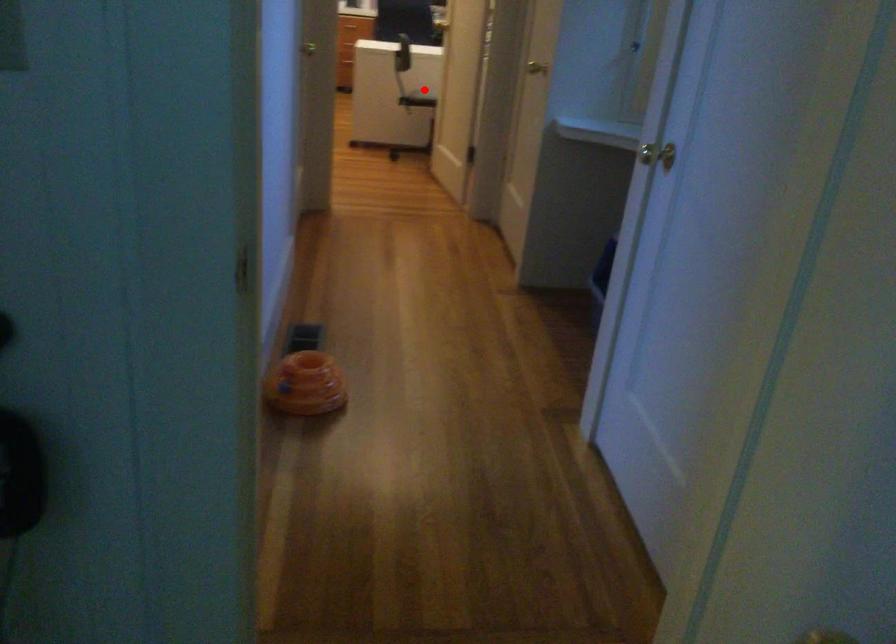
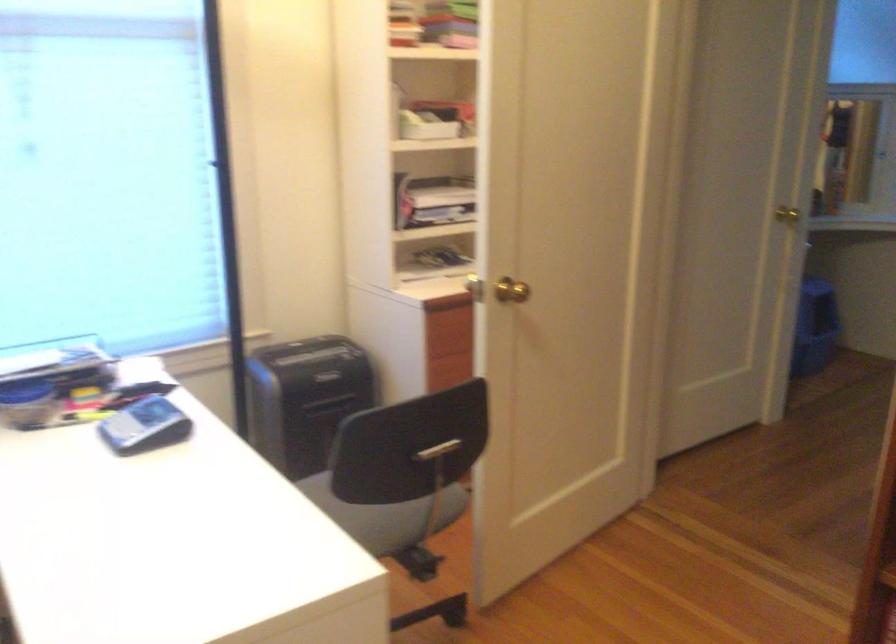
Question: I am providing you with two images of the same scene from different viewpoints. A red point is shown in image1. For the corresponding object point in image2, is it positioned nearer or farther from the camera?

Choices:
 (A) Nearer
 (B) Farther

Answer: (A)